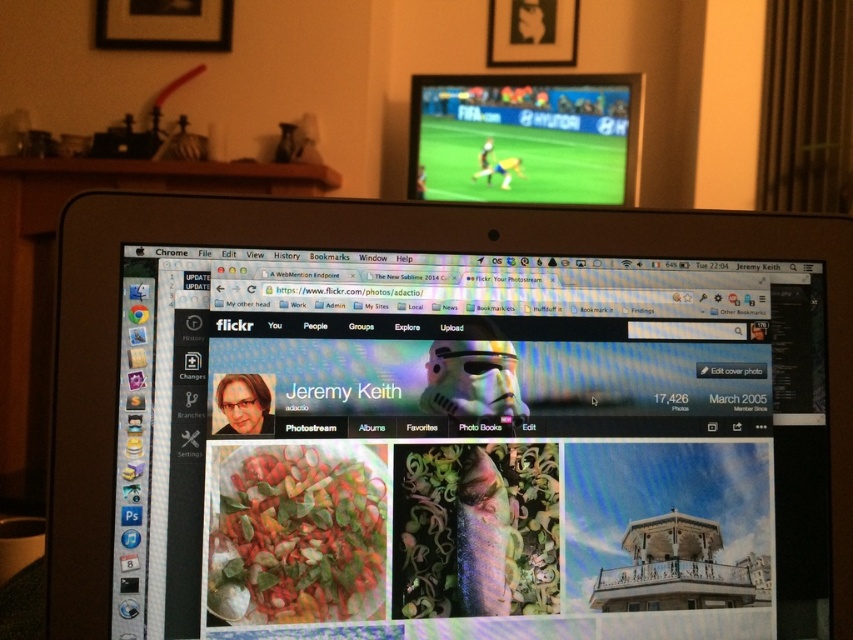
Between satin black monitor at center and matte plastic tv at upper center, which one is positioned higher?

matte plastic tv at upper center is above.

Who is positioned more to the right, satin black monitor at center or matte plastic tv at upper center?

From the viewer's perspective, matte plastic tv at upper center appears more on the right side.

Where is `satin black monitor at center`? Image resolution: width=853 pixels, height=640 pixels. satin black monitor at center is located at coordinates (x=448, y=420).

Image resolution: width=853 pixels, height=640 pixels. Find the location of `satin black monitor at center`. satin black monitor at center is located at coordinates (448, 420).